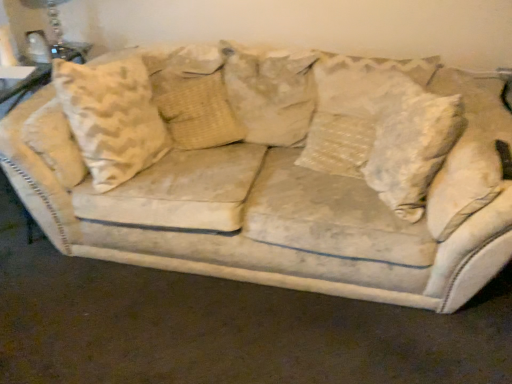
Question: Is clear glass table lamp at upper left situated inside beige fabric pillow at center, which is counted as the 2th pillow, starting from the left, or outside?

Choices:
 (A) outside
 (B) inside

Answer: (A)

Question: From a real-world perspective, is clear glass table lamp at upper left positioned above or below beige fabric pillow at center, arranged as the 2th pillow when viewed from the right?

Choices:
 (A) below
 (B) above

Answer: (B)

Question: Estimate the real-world distances between objects in this image. Which object is closer to the white textured pillow at center, arranged as the first pillow when viewed from the right?

Choices:
 (A) beige textured pillow at center, which ranks as the 1th pillow in left-to-right order
 (B) clear glass table lamp at upper left
 (C) beige fabric pillow at center, which is counted as the 2th pillow, starting from the left

Answer: (C)

Question: Which object is positioned closest to the clear glass table lamp at upper left?

Choices:
 (A) white textured pillow at center, which is counted as the 3th pillow, starting from the left
 (B) beige fabric pillow at center, which is counted as the 2th pillow, starting from the left
 (C) beige textured pillow at center, arranged as the 3th pillow when viewed from the right

Answer: (C)